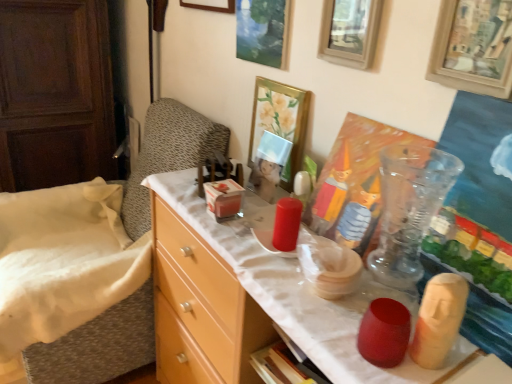
The width and height of the screenshot is (512, 384). In order to click on gold metallic picture frame at upper center, which ranks as the third picture frame in right-to-left order in this screenshot , I will do `click(280, 122)`.

You are a GUI agent. You are given a task and a screenshot of the screen. Output one action in this format:
    pyautogui.click(x=<x>, y=<y>)
    Task: Click on the matte red glass at lower right
    This screenshot has width=512, height=384.
    Given the screenshot: What is the action you would take?
    pyautogui.click(x=384, y=333)

What is the approximate height of matte wooden picture frame at upper center, arranged as the fifth picture frame when viewed from the right?

The height of matte wooden picture frame at upper center, arranged as the fifth picture frame when viewed from the right, is 7.59 inches.

Identify the location of matte wooden picture frame at upper center, the second picture frame when ordered from left to right. This screenshot has height=384, width=512. (262, 31).

What is the approximate height of matte wood desk at center?

33.53 inches.

Where is `light wood dresser at left`? light wood dresser at left is located at coordinates (98, 345).

Where is `gold metallic picture frame at upper center, which ranks as the 3th picture frame in left-to-right order`? This screenshot has width=512, height=384. gold metallic picture frame at upper center, which ranks as the 3th picture frame in left-to-right order is located at coordinates (280, 122).

Where is `the 3rd picture frame positioned above the matte red glass at lower right (from the image's perspective)`? The height and width of the screenshot is (384, 512). the 3rd picture frame positioned above the matte red glass at lower right (from the image's perspective) is located at coordinates (349, 32).

Considering their positions, is matte red glass at lower right located in front of or behind wooden picture frame at upper center, the 4th picture frame from the left?

Visually, matte red glass at lower right is located in front of wooden picture frame at upper center, the 4th picture frame from the left.

Would you say matte red glass at lower right contains wooden picture frame at upper center, which is the second picture frame from right to left?

No, wooden picture frame at upper center, which is the second picture frame from right to left, is not inside matte red glass at lower right.

From the image's perspective, which is above, light wood dresser at left or gold metallic picture frame at upper center, which ranks as the third picture frame in right-to-left order?

gold metallic picture frame at upper center, which ranks as the third picture frame in right-to-left order, is shown above in the image.

Could you tell me if light wood dresser at left is facing gold metallic picture frame at upper center, which ranks as the third picture frame in right-to-left order?

No, light wood dresser at left is not oriented towards gold metallic picture frame at upper center, which ranks as the third picture frame in right-to-left order.

How many degrees apart are the facing directions of light wood dresser at left and gold metallic picture frame at upper center, which ranks as the third picture frame in right-to-left order?

0.246 degrees.

Does point (103, 370) lie in front of point (280, 100)?

No, it is not.

Is gold metallic picture frame at upper center, which ranks as the 3th picture frame in left-to-right order, at the back of light wood dresser at left?

That's not correct — light wood dresser at left is not looking away from gold metallic picture frame at upper center, which ranks as the 3th picture frame in left-to-right order.

Is light wood dresser at left far away from gold metallic picture frame at upper center, which ranks as the third picture frame in right-to-left order?

Indeed, light wood dresser at left is not near gold metallic picture frame at upper center, which ranks as the third picture frame in right-to-left order.

Between light wood dresser at left and gold metallic picture frame at upper center, which ranks as the third picture frame in right-to-left order, which one appears on the right side from the viewer's perspective?

gold metallic picture frame at upper center, which ranks as the third picture frame in right-to-left order, is more to the right.

Does gold metallic picture frame at upper center, which ranks as the 3th picture frame in left-to-right order, have a greater width compared to white fabric bedsheet at left?

Incorrect, the width of gold metallic picture frame at upper center, which ranks as the 3th picture frame in left-to-right order, does not surpass that of white fabric bedsheet at left.

Is there a large distance between gold metallic picture frame at upper center, which ranks as the 3th picture frame in left-to-right order, and white fabric bedsheet at left?

That's not correct — gold metallic picture frame at upper center, which ranks as the 3th picture frame in left-to-right order, is a little close to white fabric bedsheet at left.

Is the position of gold metallic picture frame at upper center, which ranks as the third picture frame in right-to-left order, more distant than that of white fabric bedsheet at left?

Yes, gold metallic picture frame at upper center, which ranks as the third picture frame in right-to-left order, is further from the camera.

Is gold metallic picture frame at upper center, which ranks as the 3th picture frame in left-to-right order, positioned beyond the bounds of white fabric bedsheet at left?

Yes, gold metallic picture frame at upper center, which ranks as the 3th picture frame in left-to-right order, is outside of white fabric bedsheet at left.

Is matte wood desk at center next to matte wooden picture frame at upper center, the 1th picture frame positioned from the left, and touching it?

No, matte wood desk at center is not in contact with matte wooden picture frame at upper center, the 1th picture frame positioned from the left.

Relative to matte wooden picture frame at upper center, arranged as the fifth picture frame when viewed from the right, is matte wood desk at center in front or behind?

matte wood desk at center is positioned closer to the viewer than matte wooden picture frame at upper center, arranged as the fifth picture frame when viewed from the right.

Considering the relative sizes of matte wood desk at center and matte wooden picture frame at upper center, arranged as the fifth picture frame when viewed from the right, in the image provided, is matte wood desk at center thinner than matte wooden picture frame at upper center, arranged as the fifth picture frame when viewed from the right,?

No, matte wood desk at center is not thinner than matte wooden picture frame at upper center, arranged as the fifth picture frame when viewed from the right.

Is matte wooden picture frame at upper center, the second picture frame when ordered from left to right, oriented towards matte wood desk at center?

No, matte wooden picture frame at upper center, the second picture frame when ordered from left to right, is not aimed at matte wood desk at center.

From the image's perspective, is matte wooden picture frame at upper center, the second picture frame when ordered from left to right, above matte wood desk at center?

Yes.

The image size is (512, 384). I want to click on desk in front of the matte wooden picture frame at upper center, the second picture frame when ordered from left to right, so click(298, 290).

Considering the sizes of objects matte wooden picture frame at upper center, the second picture frame when ordered from left to right, and matte wood desk at center in the image provided, who is shorter, matte wooden picture frame at upper center, the second picture frame when ordered from left to right, or matte wood desk at center?

Standing shorter between the two is matte wooden picture frame at upper center, the second picture frame when ordered from left to right.

Between matte wood desk at center and wooden picture frame at upper right, the fifth picture frame positioned from the left, which one has smaller size?

With smaller size is wooden picture frame at upper right, the fifth picture frame positioned from the left.

Is matte wood desk at center taller than wooden picture frame at upper right, the fifth picture frame positioned from the left?

Indeed, matte wood desk at center has a greater height compared to wooden picture frame at upper right, the fifth picture frame positioned from the left.

Locate an element on the screen. The height and width of the screenshot is (384, 512). desk that is under the wooden picture frame at upper right, arranged as the first picture frame when viewed from the right (from a real-world perspective) is located at coordinates (298, 290).

Can you confirm if matte wood desk at center is positioned to the left of wooden picture frame at upper right, the fifth picture frame positioned from the left?

Indeed, matte wood desk at center is positioned on the left side of wooden picture frame at upper right, the fifth picture frame positioned from the left.

The height and width of the screenshot is (384, 512). What are the coordinates of `the 1st picture frame behind the matte red glass at lower right, starting your count from the anchor` in the screenshot? It's located at (349, 32).

The image size is (512, 384). In the image, there is a gold metallic picture frame at upper center, which ranks as the 3th picture frame in left-to-right order. Find the location of `furniture below it (from a real-world perspective)`. furniture below it (from a real-world perspective) is located at coordinates (98, 345).

Which object lies nearer to the anchor point wooden picture frame at upper right, arranged as the first picture frame when viewed from the right, light wood dresser at left or matte wooden picture frame at upper center, arranged as the fifth picture frame when viewed from the right?

matte wooden picture frame at upper center, arranged as the fifth picture frame when viewed from the right, lies closer to wooden picture frame at upper right, arranged as the first picture frame when viewed from the right, than the other object.

Looking at the image, which one is located further to matte red glass at lower right, wooden picture frame at upper right, arranged as the first picture frame when viewed from the right, or gold metallic picture frame at upper center, which ranks as the 3th picture frame in left-to-right order?

Based on the image, gold metallic picture frame at upper center, which ranks as the 3th picture frame in left-to-right order, appears to be further to matte red glass at lower right.

Looking at the image, which one is located further to wooden picture frame at upper center, which is the second picture frame from right to left, matte wooden picture frame at upper center, marked as the 4th picture frame in a right-to-left arrangement, or matte wood desk at center?

matte wood desk at center lies further to wooden picture frame at upper center, which is the second picture frame from right to left, than the other object.

Estimate the real-world distances between objects in this image. Which object is further from matte wooden picture frame at upper center, arranged as the fifth picture frame when viewed from the right, white fabric bedsheet at left or light wood dresser at left?

white fabric bedsheet at left.

When comparing their distances from matte wooden picture frame at upper center, the second picture frame when ordered from left to right, does matte red glass at lower right or light wood dresser at left seem further?

matte red glass at lower right.

Based on their spatial positions, is matte wood desk at center or gold metallic picture frame at upper center, which ranks as the 3th picture frame in left-to-right order, closer to matte wooden picture frame at upper center, arranged as the fifth picture frame when viewed from the right?

gold metallic picture frame at upper center, which ranks as the 3th picture frame in left-to-right order, is positioned closer to the anchor matte wooden picture frame at upper center, arranged as the fifth picture frame when viewed from the right.

Based on their spatial positions, is gold metallic picture frame at upper center, which ranks as the third picture frame in right-to-left order, or wooden picture frame at upper center, the 4th picture frame from the left, closer to white fabric bedsheet at left?

Among the two, gold metallic picture frame at upper center, which ranks as the third picture frame in right-to-left order, is located nearer to white fabric bedsheet at left.

When comparing their distances from light wood dresser at left, does gold metallic picture frame at upper center, which ranks as the third picture frame in right-to-left order, or white fabric bedsheet at left seem further?

The object further to light wood dresser at left is gold metallic picture frame at upper center, which ranks as the third picture frame in right-to-left order.

Image resolution: width=512 pixels, height=384 pixels. What are the coordinates of `candle holder between wooden picture frame at upper right, the fifth picture frame positioned from the left, and matte wood desk at center vertically` in the screenshot? It's located at (384, 333).

Identify the location of furniture between white fabric bedsheet at left and matte red glass at lower right in the horizontal direction. This screenshot has height=384, width=512. (98, 345).

Locate an element on the screen. The height and width of the screenshot is (384, 512). furniture between matte wooden picture frame at upper center, arranged as the fifth picture frame when viewed from the right, and matte red glass at lower right in the up-down direction is located at coordinates (98, 345).

The image size is (512, 384). What are the coordinates of `furniture between matte wooden picture frame at upper center, arranged as the fifth picture frame when viewed from the right, and white fabric bedsheet at left from top to bottom` in the screenshot? It's located at (98, 345).